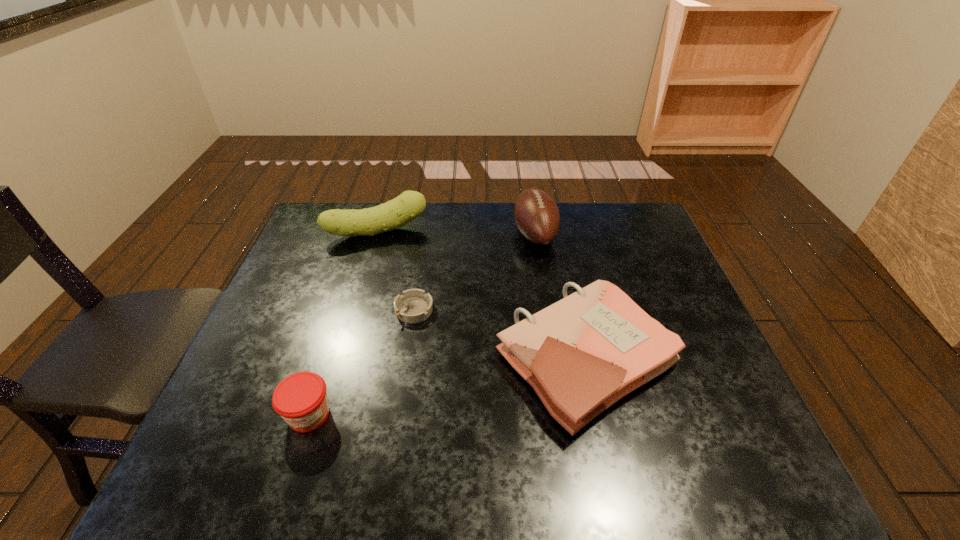
I want to click on football (American) that is positioned at the far edge, so click(536, 214).

The height and width of the screenshot is (540, 960). What are the coordinates of `cucumber positioned at the far edge` in the screenshot? It's located at (395, 213).

Where is `cucumber present at the left edge`? Image resolution: width=960 pixels, height=540 pixels. cucumber present at the left edge is located at coordinates (395, 213).

The height and width of the screenshot is (540, 960). What are the coordinates of `jam present at the left edge` in the screenshot? It's located at point(300,399).

Identify the location of object present at the right edge. (582, 354).

Where is `object that is at the far left corner`? This screenshot has height=540, width=960. object that is at the far left corner is located at coordinates (395, 213).

Where is `vacant space at the far edge of the desktop`? vacant space at the far edge of the desktop is located at coordinates (468, 242).

At what (x,y) coordinates should I click in order to perform the action: click on free space at the near edge. Please return your answer as a coordinate pair (x, y). Image resolution: width=960 pixels, height=540 pixels. Looking at the image, I should click on (561, 444).

At what (x,y) coordinates should I click in order to perform the action: click on vacant space at the left edge. Please return your answer as a coordinate pair (x, y). The height and width of the screenshot is (540, 960). Looking at the image, I should click on click(x=269, y=400).

You are a GUI agent. You are given a task and a screenshot of the screen. Output one action in this format:
    pyautogui.click(x=<x>, y=<y>)
    Task: Click on the vacant region at the right edge
    The image size is (960, 540).
    Given the screenshot: What is the action you would take?
    pyautogui.click(x=694, y=402)